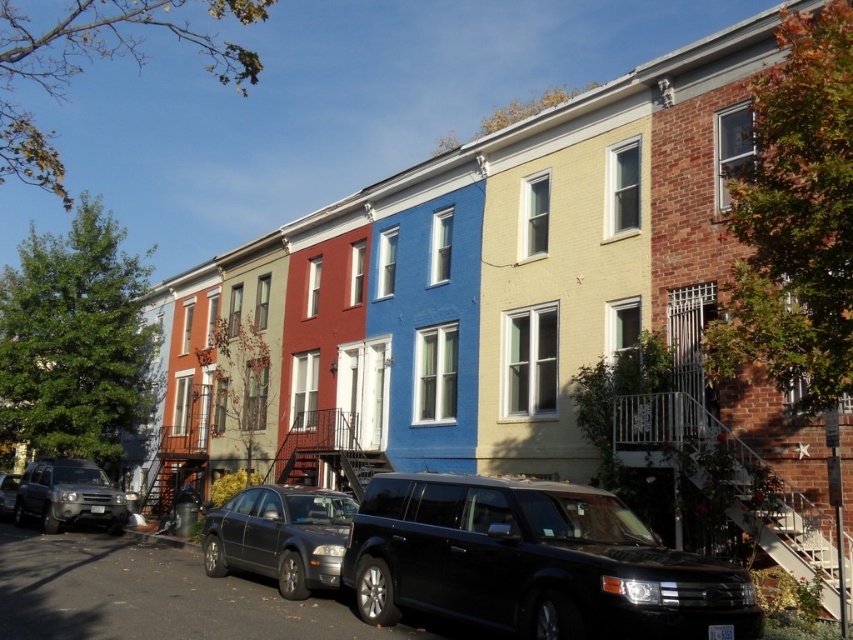
You are standing at the starting point of the street and want to park your car, which is 4.5 meters long, between the metallic gray sedan at center and the curb. Is there enough space?

The metallic gray sedan at center is located at point (x=279, y=536). Without specific distance information between the sedan and the curb, it is impossible to determine if there is enough space for a 4.5 meter car. More information is needed.

You are a pedestrian standing at the intersection and want to cross the street to reach the blue townhouse. There is a metallic gray sedan at center and a silver metallic suv at lower left. Which vehicle is closer to you?

The silver metallic suv at lower left is closer to you because it is positioned lower left, while the metallic gray sedan at center is above it, meaning it is further away.

You are standing at the intersection observing the row of colorful townhouses. There is a point marked at coordinates point [279,536]. What object is located at that point?

The metallic gray sedan at center is located at point [279,536].